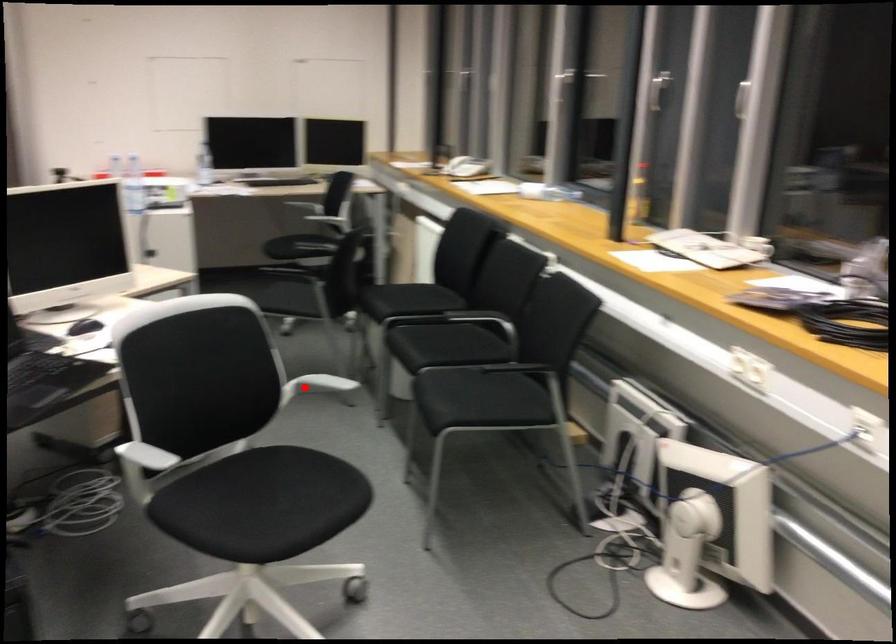
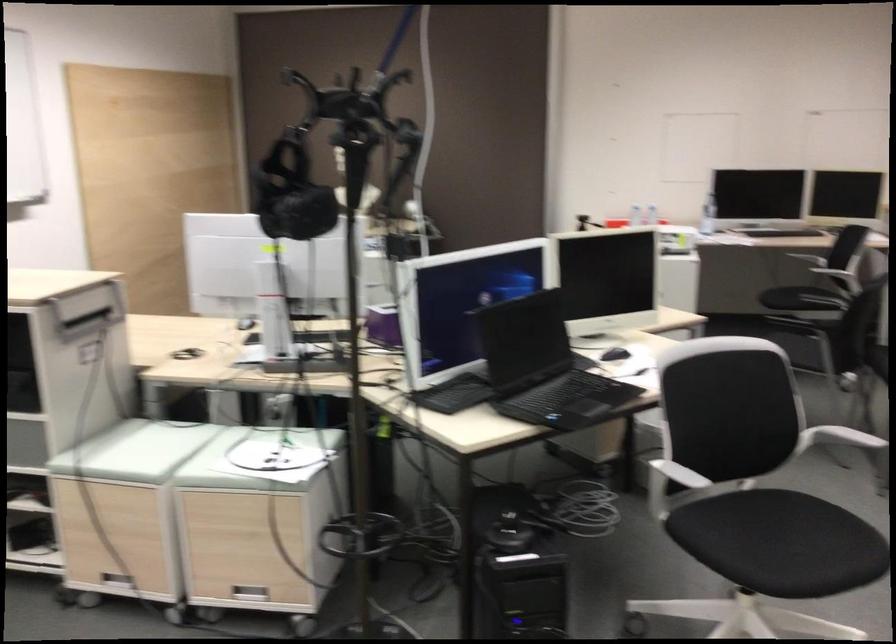
Where in the second image is the point corresponding to the highlighted location from the first image?

(840, 437)